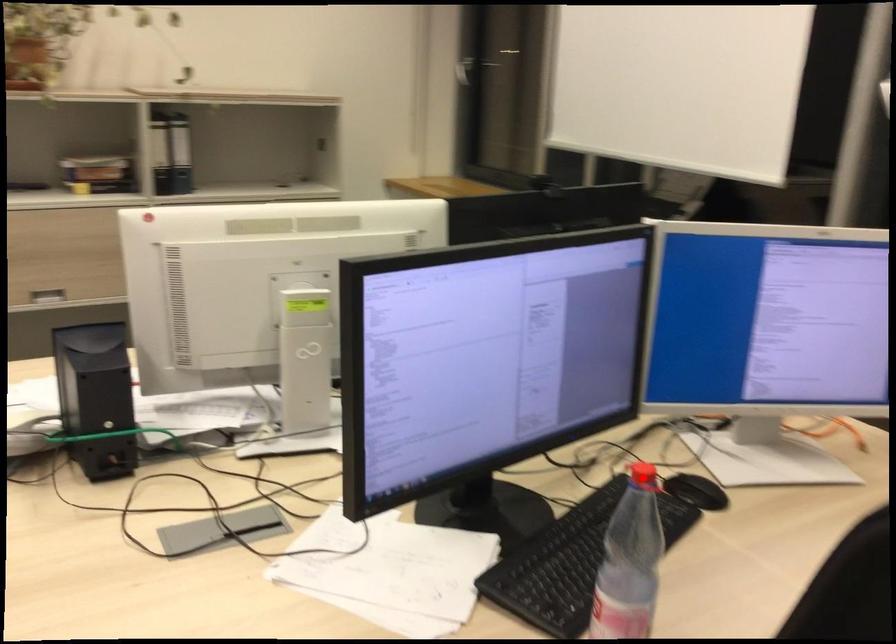
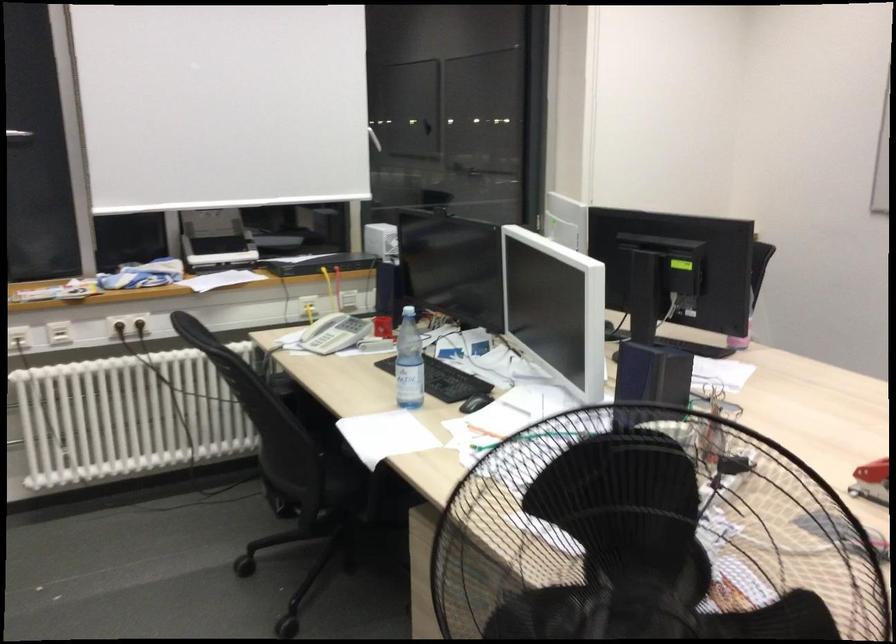
Question: I am providing you with two images of the same scene from different viewpoints. A red point is marked on the first image. At the location where the point appears in image 1, is it still visible in image 2?

Choices:
 (A) Yes
 (B) No

Answer: (B)